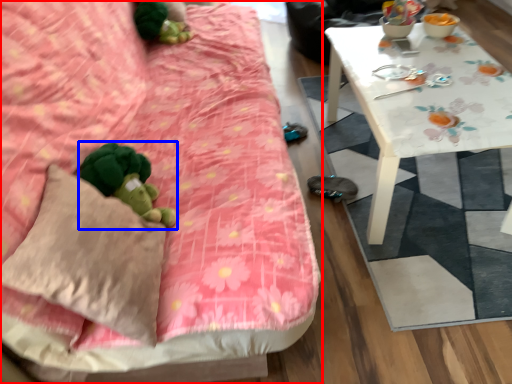
Question: Which of the following is the farthest to the observer, studio couch (highlighted by a red box) or toy (highlighted by a blue box)?

Choices:
 (A) studio couch
 (B) toy

Answer: (B)